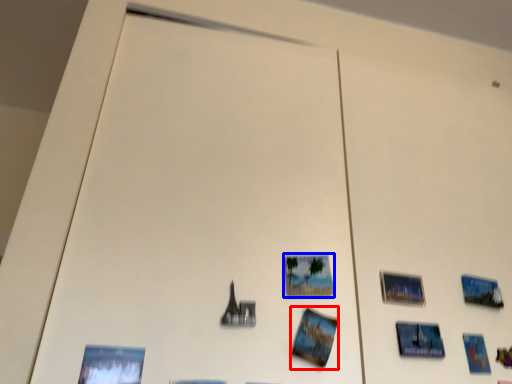
Question: Which point is further to the camera, postcard (highlighted by a red box) or picture frame (highlighted by a blue box)?

Choices:
 (A) postcard
 (B) picture frame

Answer: (B)